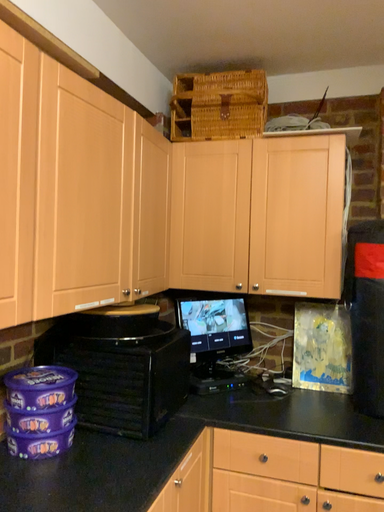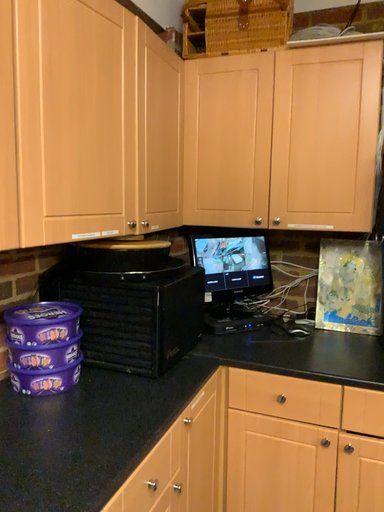
Question: Which way did the camera rotate in the video?

Choices:
 (A) rotated downward
 (B) rotated upward

Answer: (A)